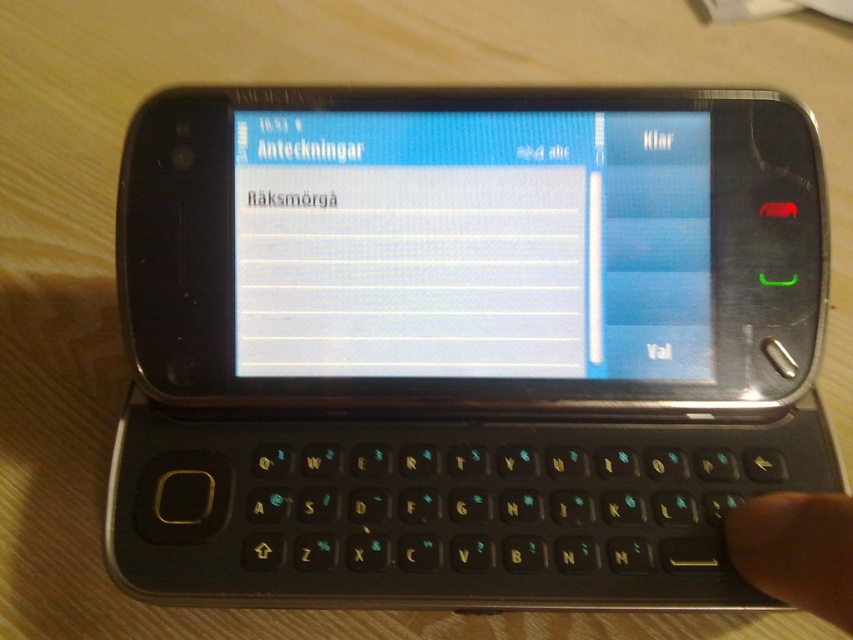
Does white glossy screen at center have a larger size compared to skinsmoothhand at lower right?

Yes, white glossy screen at center is bigger than skinsmoothhand at lower right.

Is white glossy screen at center taller than skinsmoothhand at lower right?

Yes.

Is point (312, 131) positioned after point (796, 592)?

Yes, it is behind point (796, 592).

Locate an element on the screen. white glossy screen at center is located at coordinates (473, 244).